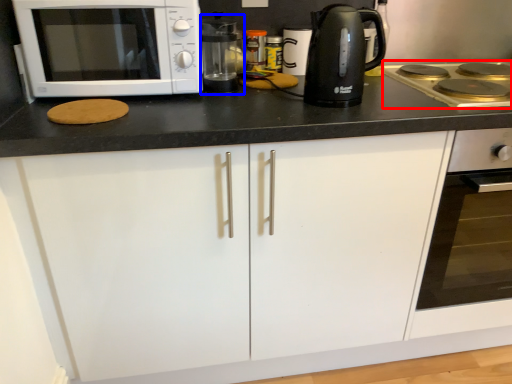
Question: Which point is further to the camera, gas stove (highlighted by a red box) or coffee machine (highlighted by a blue box)?

Choices:
 (A) gas stove
 (B) coffee machine

Answer: (B)